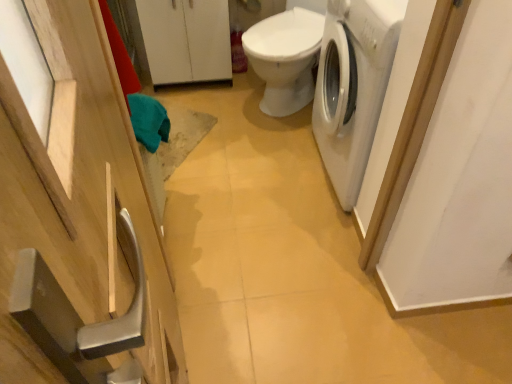
Question: Is white glossy toilet at center in front of or behind white matte cabinet at upper center, positioned as the 2th cabinetry in front-to-back order, in the image?

Choices:
 (A) behind
 (B) front

Answer: (B)

Question: Considering the positions of white glossy toilet at center and white matte cabinet at upper center, arranged as the first cabinetry when viewed from the back, in the image, is white glossy toilet at center taller or shorter than white matte cabinet at upper center, arranged as the first cabinetry when viewed from the back,?

Choices:
 (A) tall
 (B) short

Answer: (A)

Question: Based on their relative distances, which object is farther from the white matte washing machine at right?

Choices:
 (A) white matte cabinet at upper center, placed as the first cabinetry when sorted from top to bottom
 (B) natural wood cabinet at left, marked as the second cabinetry in a back-to-front arrangement
 (C) white glossy toilet at center

Answer: (B)

Question: Which object is the farthest from the white glossy toilet at center?

Choices:
 (A) white matte cabinet at upper center, the 2th cabinetry from the bottom
 (B) white matte washing machine at right
 (C) natural wood cabinet at left, the 1th cabinetry in the bottom-to-top sequence

Answer: (C)